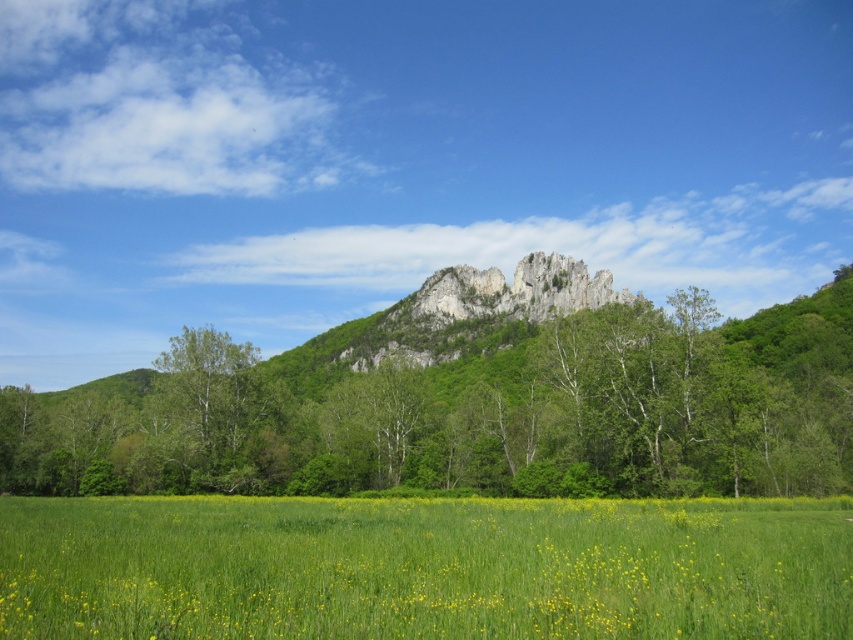
You are a gardener planning to plant a new tree in the green grass at lower center. Considering the size of the green leafy tree at center, will there be enough space for the new tree to grow without overcrowding?

The green leafy tree at center is larger in size than the green grass at lower center, so there may not be enough space for the new tree to grow without overcrowding.

You are standing at the point with coordinates point (173, 484) and want to walk towards the point (619, 570). Given the scene described, will you have a clear path to walk there without obstacles?

Point (619, 570) is in front of point (173, 484), so yes, you can walk there directly since the path is clear.